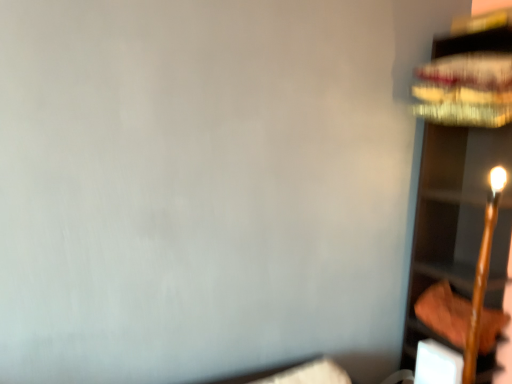
In order to face wooden lamp at right, should I rotate leftwards or rightwards?

Turn right approximately 27.046 degrees to face it.

Describe the element at coordinates (456, 221) in the screenshot. This screenshot has height=384, width=512. I see `wooden lamp at right` at that location.

At what (x,y) coordinates should I click in order to perform the action: click on wooden lamp at right. Please return your answer as a coordinate pair (x, y). This screenshot has width=512, height=384. Looking at the image, I should click on (456, 221).

Where is `wooden lamp at right`? Image resolution: width=512 pixels, height=384 pixels. wooden lamp at right is located at coordinates (456, 221).